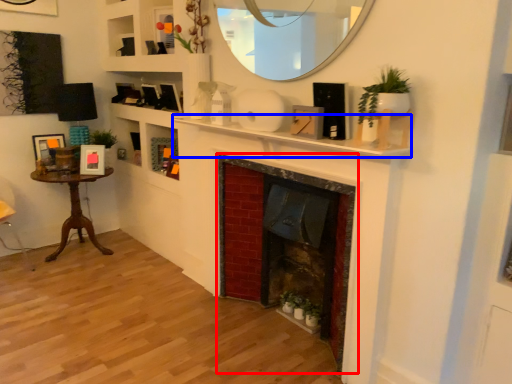
Question: Among these objects, which one is farthest to the camera, fireplace (highlighted by a red box) or mantle (highlighted by a blue box)?

Choices:
 (A) fireplace
 (B) mantle

Answer: (A)